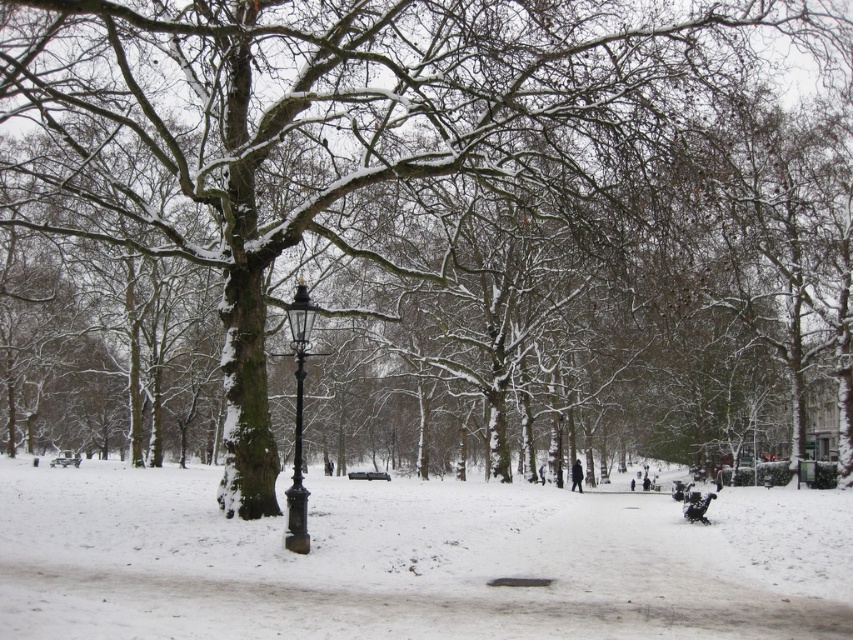
Question: Is white powdery snow at center to the right of black wrought iron lamp post at center from the viewer's perspective?

Choices:
 (A) yes
 (B) no

Answer: (A)

Question: Among these points, which one is nearest to the camera?

Choices:
 (A) (0, 483)
 (B) (300, 308)

Answer: (B)

Question: Does white powdery snow at center appear on the right side of black wrought iron lamp post at center?

Choices:
 (A) no
 (B) yes

Answer: (B)

Question: Which object appears farthest from the camera in this image?

Choices:
 (A) white powdery snow at center
 (B) black wrought iron lamp post at center

Answer: (B)

Question: Which point is farther from the camera taking this photo?

Choices:
 (A) (288, 353)
 (B) (607, 534)

Answer: (A)

Question: Does white powdery snow at center appear on the right side of black wrought iron lamp post at center?

Choices:
 (A) yes
 (B) no

Answer: (A)